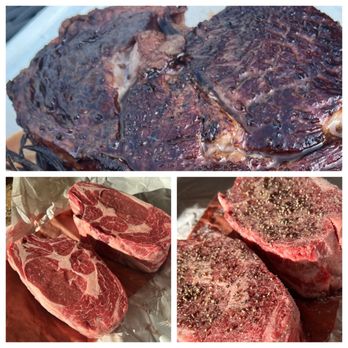
What are the coordinates of `table` in the screenshot? It's located at (24, 15).